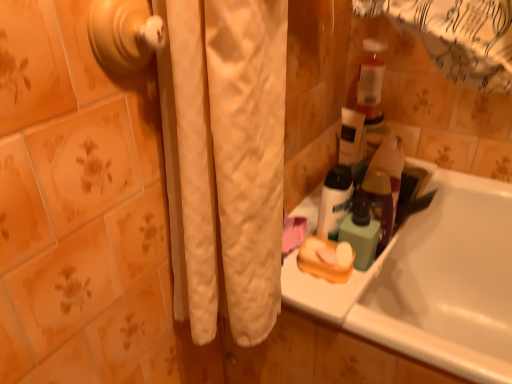
Find the location of a particular element. The width and height of the screenshot is (512, 384). vacant region in front of green matte bottle at upper right is located at coordinates (367, 310).